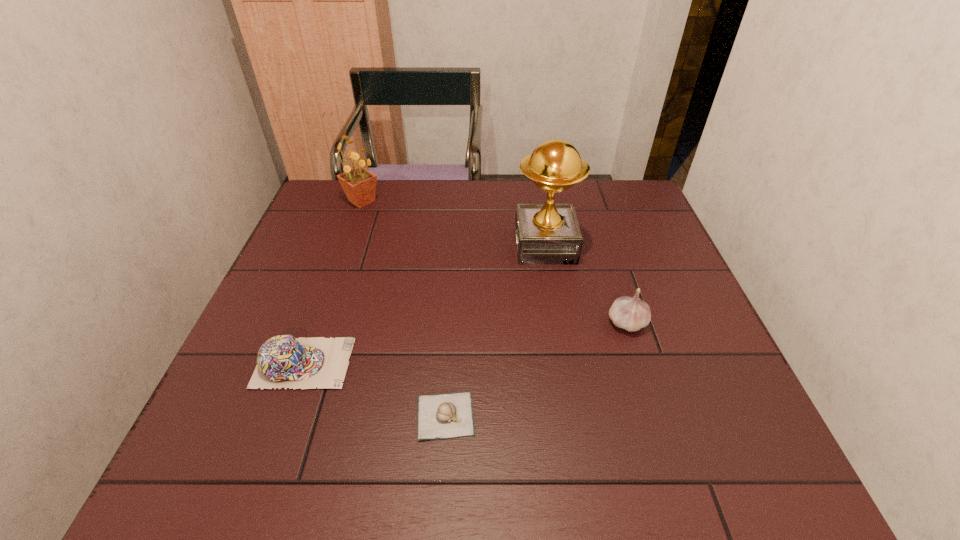
Where is `object that is the second closest to the tallest object`? The image size is (960, 540). object that is the second closest to the tallest object is located at coordinates (450, 415).

Where is `object that is the second closest to the second nearest object`? object that is the second closest to the second nearest object is located at coordinates (546, 234).

Where is `free space in the image that satisfies the following two spatial constraints: 1. at the front of the sunflower with flowers visible; 2. on the right side of the right garlic`? free space in the image that satisfies the following two spatial constraints: 1. at the front of the sunflower with flowers visible; 2. on the right side of the right garlic is located at coordinates (319, 323).

Where is `free point that satisfies the following two spatial constraints: 1. at the front of the second tallest object with flowers visible; 2. on the front, side, and top of the cap`? free point that satisfies the following two spatial constraints: 1. at the front of the second tallest object with flowers visible; 2. on the front, side, and top of the cap is located at coordinates (305, 363).

Identify the location of vacant space that satisfies the following two spatial constraints: 1. on the front-facing side of the second object from right to left; 2. on the back side of the farther garlic. This screenshot has height=540, width=960. pyautogui.click(x=558, y=323).

Where is `vacant region that satisfies the following two spatial constraints: 1. at the front of the shortest object with flowers visible; 2. on the left side of the second tallest object`? This screenshot has height=540, width=960. vacant region that satisfies the following two spatial constraints: 1. at the front of the shortest object with flowers visible; 2. on the left side of the second tallest object is located at coordinates tap(286, 415).

At what (x,y) coordinates should I click in order to perform the action: click on vacant space that satisfies the following two spatial constraints: 1. on the back side of the third shortest object; 2. on the right side of the nearer garlic. Please return your answer as a coordinate pair (x, y). Looking at the image, I should click on (451, 323).